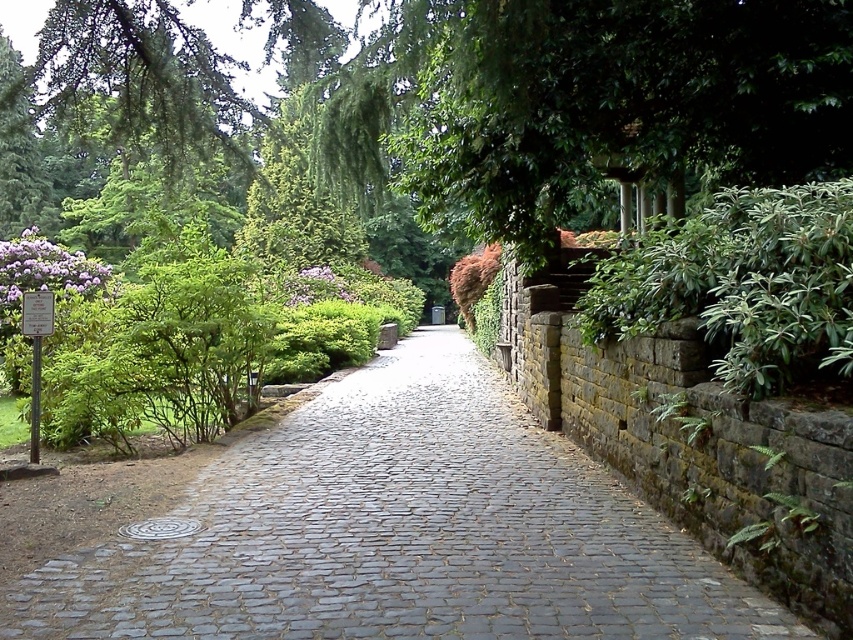
Consider the image. You are a gardener with a 1.5 meter long hose. You need to water the gray cobblestone pavement at center and the green leafy bush at right. Can you reach both areas with your current hose length without moving the hose nozzle?

The gray cobblestone pavement at center is 1.39 meters away from the green leafy bush at right. Since the hose is 1.5 meters long, it is long enough to reach both areas as the distance between them is less than the hose length.

You are a gardener planning to place a 2m wide decorative fountain in the garden. The gray cobblestone pavement at center and the green leafy bush at right are in the area. Which object has a greater width to accommodate the fountain?

The gray cobblestone pavement at center has a greater width than the green leafy bush at right, so it can accommodate the fountain.